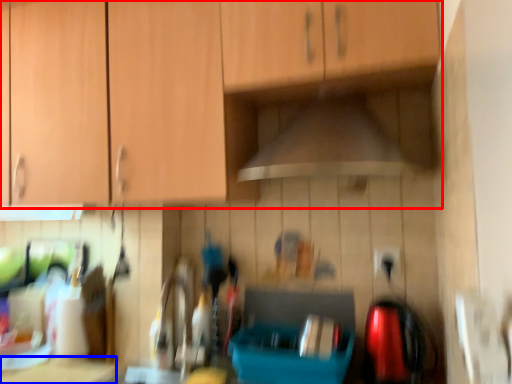
Question: Which object appears farthest to the camera in this image, cabinetry (highlighted by a red box) or counter top (highlighted by a blue box)?

Choices:
 (A) cabinetry
 (B) counter top

Answer: (B)